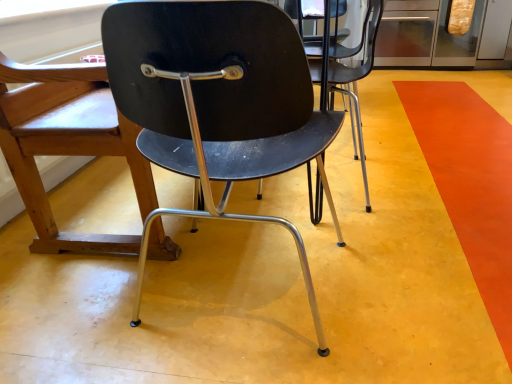
At what (x,y) coordinates should I click in order to perform the action: click on vacant region to the right of matte black chair at center, the 1th chair viewed from the front. Please return your answer as a coordinate pair (x, y). This screenshot has height=384, width=512. Looking at the image, I should click on (402, 266).